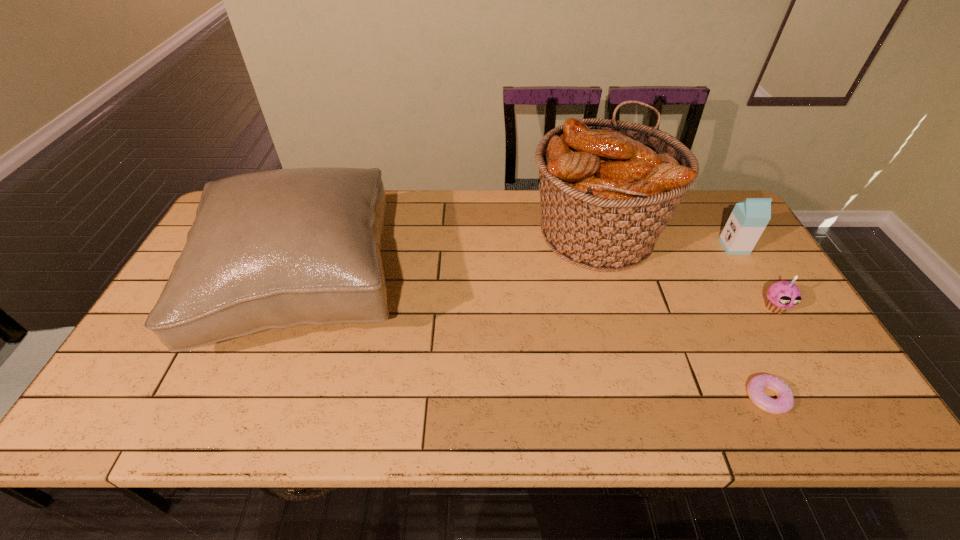
Find the location of `the fourth object from right to left`. the fourth object from right to left is located at coordinates (608, 188).

Where is `cushion`? This screenshot has height=540, width=960. cushion is located at coordinates (274, 249).

You are a GUI agent. You are given a task and a screenshot of the screen. Output one action in this format:
    pyautogui.click(x=<x>, y=<y>)
    Task: Click on the milk carton
    
    Given the screenshot: What is the action you would take?
    pyautogui.click(x=749, y=218)

I want to click on cupcake, so click(x=782, y=295).

Locate an element on the screen. The height and width of the screenshot is (540, 960). doughnut is located at coordinates (785, 400).

This screenshot has height=540, width=960. I want to click on the shortest object, so click(785, 400).

Identify the location of vacant space situated on the front of the basket. pos(623,327).

Where is `vacant space located 0.160m on the back of the leftmost object`? vacant space located 0.160m on the back of the leftmost object is located at coordinates (340, 195).

The width and height of the screenshot is (960, 540). I want to click on vacant region located on the back of the third tallest object, so click(x=705, y=197).

Where is `free space located 0.210m on the face of the fourth tallest object`? The image size is (960, 540). free space located 0.210m on the face of the fourth tallest object is located at coordinates (826, 390).